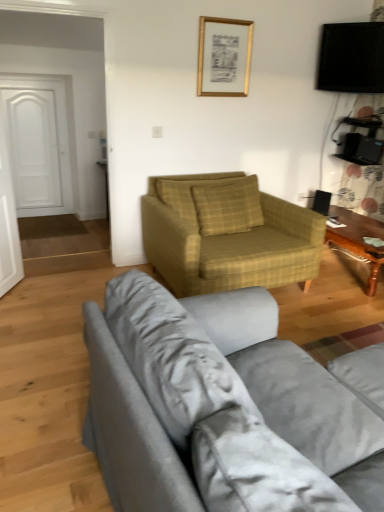
Question: Is black glossy tv at upper right a part of yellow plaid pillow at center?

Choices:
 (A) yes
 (B) no

Answer: (B)

Question: From a real-world perspective, does yellow plaid pillow at center sit lower than black glossy tv at upper right?

Choices:
 (A) yes
 (B) no

Answer: (A)

Question: Considering the relative sizes of yellow plaid pillow at center and black glossy tv at upper right in the image provided, is yellow plaid pillow at center shorter than black glossy tv at upper right?

Choices:
 (A) no
 (B) yes

Answer: (B)

Question: Would you consider yellow plaid pillow at center to be distant from black glossy tv at upper right?

Choices:
 (A) no
 (B) yes

Answer: (B)

Question: Does yellow plaid pillow at center have a larger size compared to black glossy tv at upper right?

Choices:
 (A) no
 (B) yes

Answer: (B)

Question: Looking at the image, does wooden polished coffee table at right seem bigger or smaller compared to black glossy tv at upper right?

Choices:
 (A) big
 (B) small

Answer: (A)

Question: From the image's perspective, is wooden polished coffee table at right above or below black glossy tv at upper right?

Choices:
 (A) below
 (B) above

Answer: (A)

Question: Is wooden polished coffee table at right wider or thinner than black glossy tv at upper right?

Choices:
 (A) wide
 (B) thin

Answer: (A)

Question: Considering the positions of point (372, 271) and point (337, 55), is point (372, 271) closer or farther from the camera than point (337, 55)?

Choices:
 (A) farther
 (B) closer

Answer: (B)

Question: In terms of height, does yellow plaid pillow at center look taller or shorter compared to white matte door at left?

Choices:
 (A) short
 (B) tall

Answer: (A)

Question: Would you say yellow plaid pillow at center is to the left or to the right of white matte door at left in the picture?

Choices:
 (A) right
 (B) left

Answer: (A)

Question: From the image's perspective, is yellow plaid pillow at center located above or below white matte door at left?

Choices:
 (A) below
 (B) above

Answer: (A)

Question: Based on their sizes in the image, would you say yellow plaid pillow at center is bigger or smaller than white matte door at left?

Choices:
 (A) big
 (B) small

Answer: (B)

Question: Choose the correct answer: Is gold metallic picture frame at upper center inside white matte door at left or outside it?

Choices:
 (A) outside
 (B) inside

Answer: (A)

Question: In terms of width, does gold metallic picture frame at upper center look wider or thinner when compared to white matte door at left?

Choices:
 (A) thin
 (B) wide

Answer: (A)